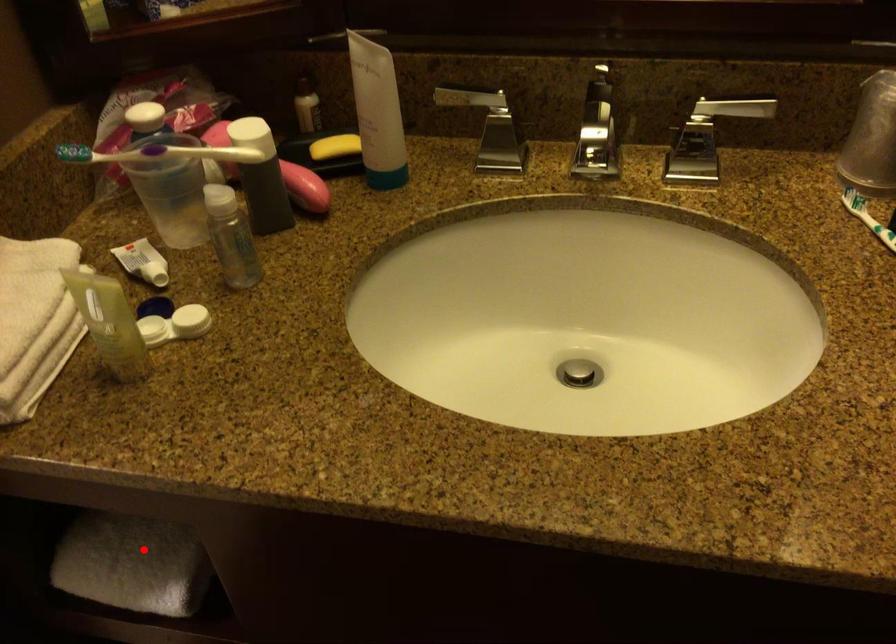
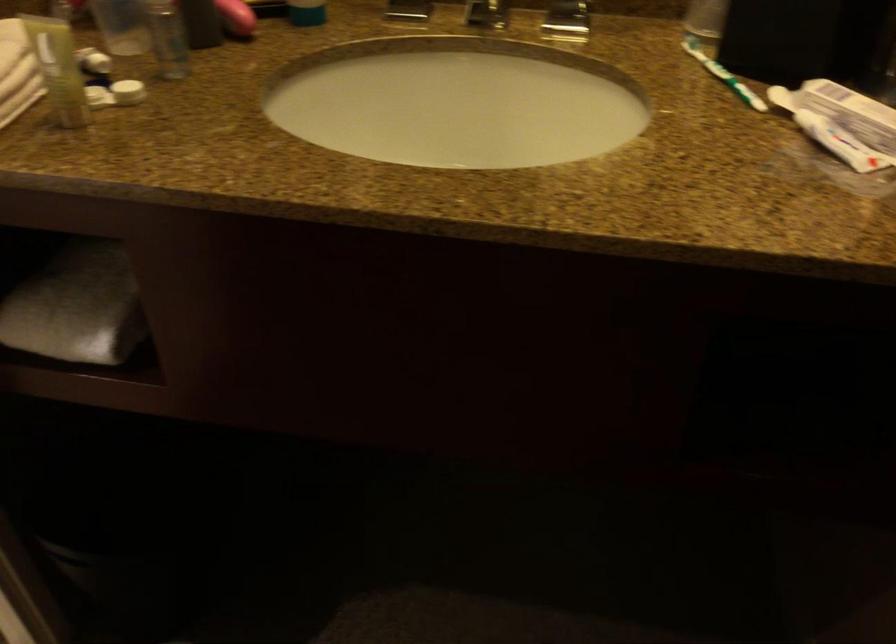
Question: I am providing you with two images of the same scene from different viewpoints. In image1, a red point is highlighted. Considering the same 3D point in image2, which of the following is correct?

Choices:
 (A) It is closer
 (B) It is farther

Answer: (B)